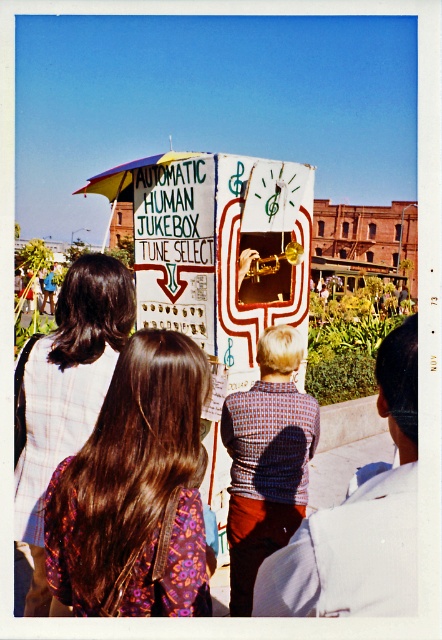
Between plaid fabric shirt at upper left and knitted sweater at center, which one appears on the right side from the viewer's perspective?

knitted sweater at center is more to the right.

Is point (45, 598) more distant than point (240, 496)?

No.

The image size is (442, 640). Identify the location of plaid fabric shirt at upper left. click(x=68, y=396).

Who is more forward, (x=95, y=554) or (x=237, y=396)?

Point (x=95, y=554)

Who is taller, brown hair at center or knitted sweater at center?

With more height is knitted sweater at center.

The height and width of the screenshot is (640, 442). Find the location of `brown hair at center`. brown hair at center is located at coordinates (134, 490).

Locate an element on the screen. This screenshot has width=442, height=640. brown hair at center is located at coordinates (134, 490).

Who is more forward, [95,605] or [72,326]?

Point [95,605] is more forward.

Between point (168, 452) and point (50, 611), which one is positioned behind?

Positioned behind is point (50, 611).

Which is in front, point (166, 378) or point (94, 378)?

Point (166, 378)

The image size is (442, 640). What are the coordinates of `brown hair at center` in the screenshot? It's located at (134, 490).